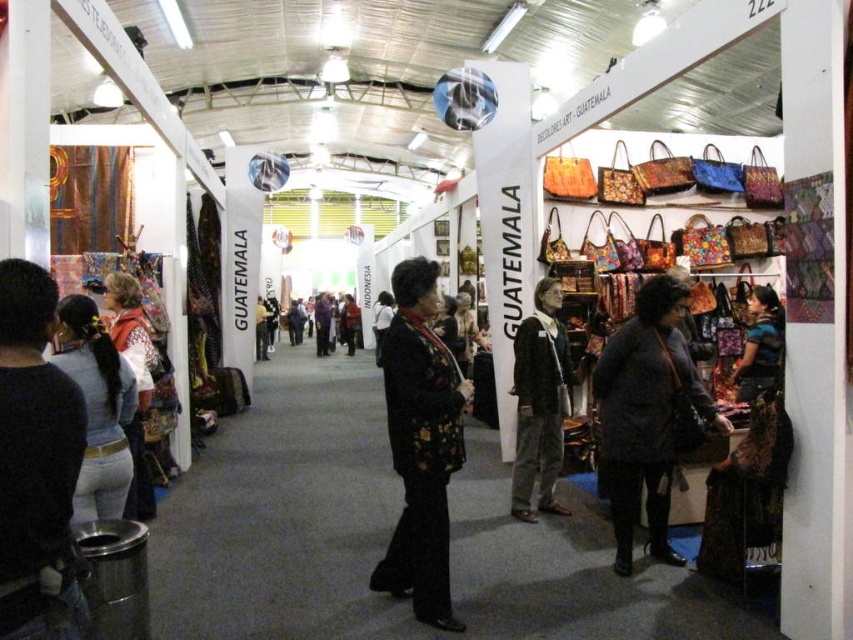
Can you confirm if patterned fabric dress at center is positioned to the left of red velvet coat at center?

In fact, patterned fabric dress at center is to the right of red velvet coat at center.

Who is shorter, patterned fabric dress at center or red velvet coat at center?

patterned fabric dress at center is shorter.

At what (x,y) coordinates should I click in order to perform the action: click on patterned fabric dress at center. Please return your answer as a coordinate pair (x, y). The height and width of the screenshot is (640, 853). Looking at the image, I should click on (759, 346).

Between black matte jacket at center and white knitwear at left, which one appears on the right side from the viewer's perspective?

black matte jacket at center

Measure the distance between point (421, 612) and camera.

Point (421, 612) is 9.30 feet away from camera.

In order to click on black matte jacket at center in this screenshot , I will do `click(421, 444)`.

In the scene shown: Can you confirm if black matte jacket at center is taller than patterned fabric dress at center?

Correct, black matte jacket at center is much taller as patterned fabric dress at center.

Who is positioned more to the right, black matte jacket at center or patterned fabric dress at center?

From the viewer's perspective, patterned fabric dress at center appears more on the right side.

Is point (436, 372) positioned after point (762, 340)?

No, (436, 372) is closer to viewer.

Find the location of a particular element. black matte jacket at center is located at coordinates (421, 444).